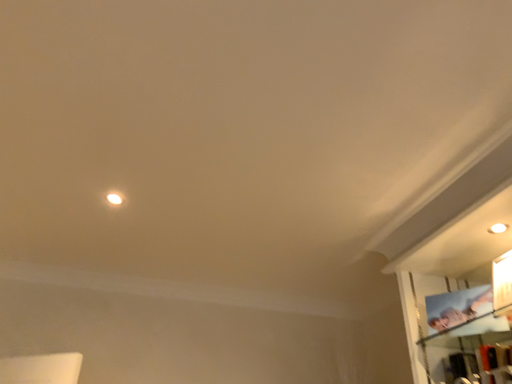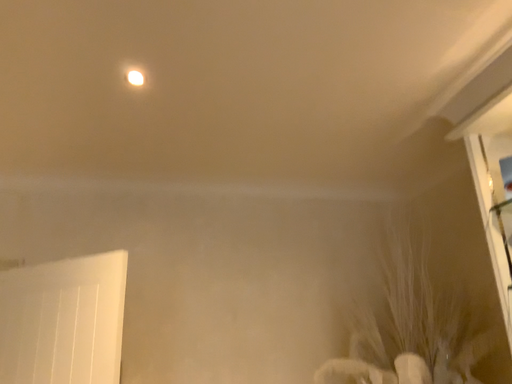
Question: Which way did the camera rotate in the video?

Choices:
 (A) rotated upward
 (B) rotated downward

Answer: (B)